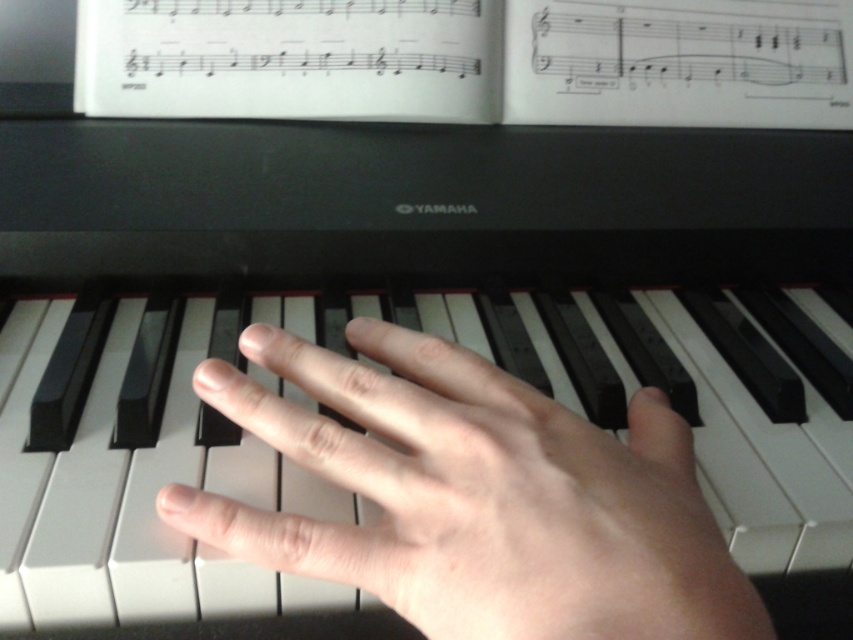
You are a music teacher observing a student practicing. You notice the smooth skin hand at center and the white paper at upper center. Which object is larger in size?

The white paper at upper center is larger than the smooth skin hand at center.